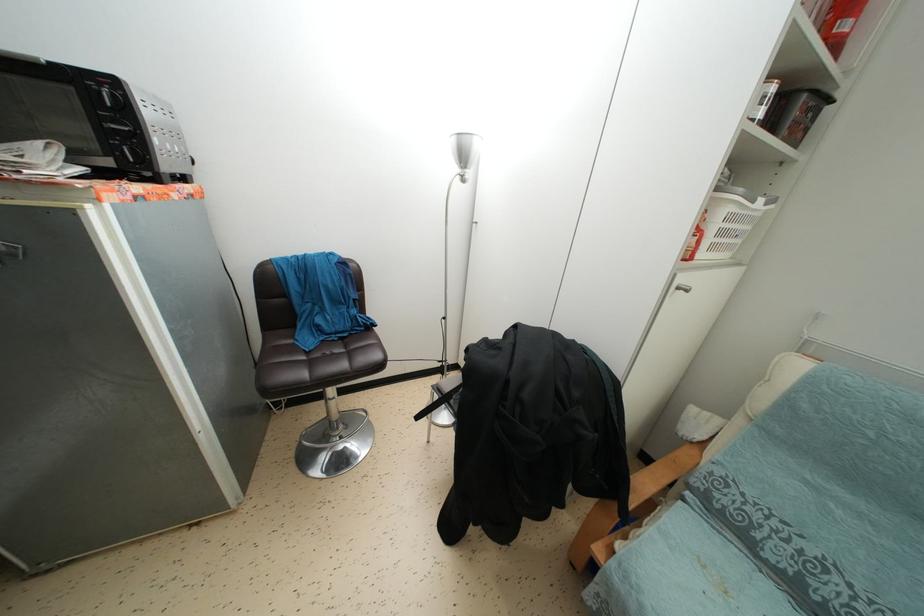
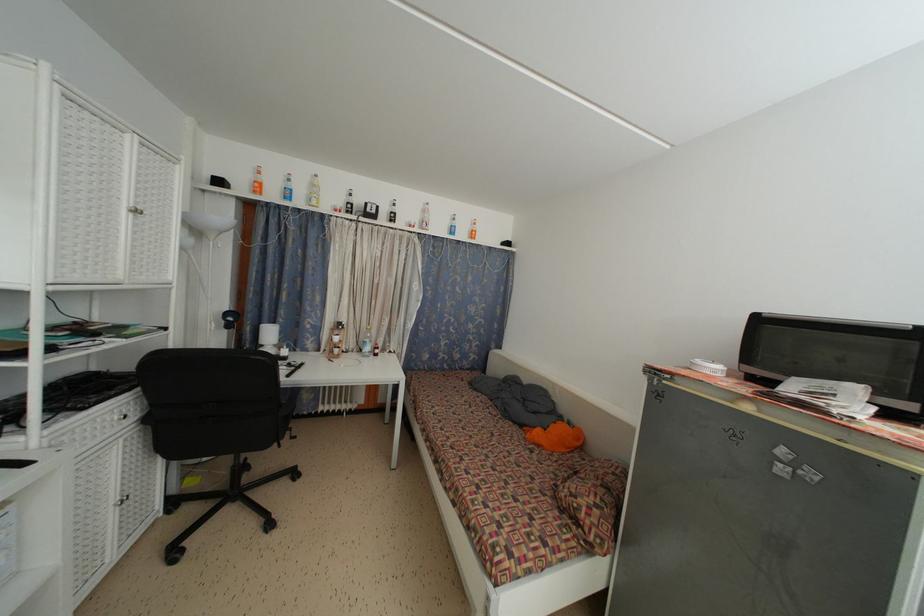
Question: The first image is from the beginning of the video and the second image is from the end. How did the camera likely rotate when shooting the video?

Choices:
 (A) Left
 (B) Right
 (C) Up
 (D) Down

Answer: (A)